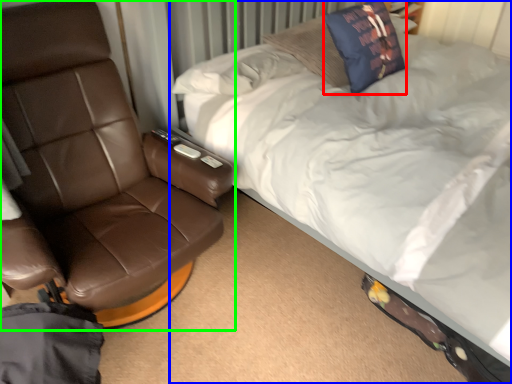
Question: Based on their relative distances, which object is farther from throw pillow (highlighted by a red box)? Choose from bed (highlighted by a blue box) and chair (highlighted by a green box).

Choices:
 (A) bed
 (B) chair

Answer: (B)